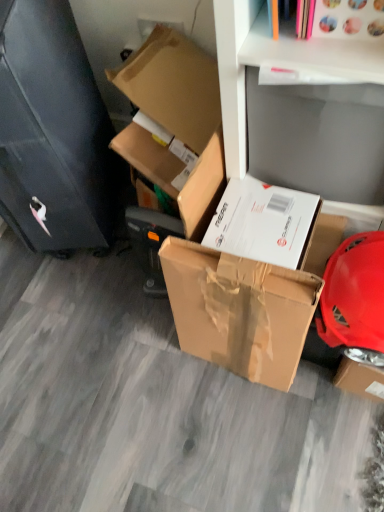
The image size is (384, 512). I want to click on vacant area situated to the left side of brown cardboard box at center, which is the 1th box in bottom-to-top order, so click(x=160, y=374).